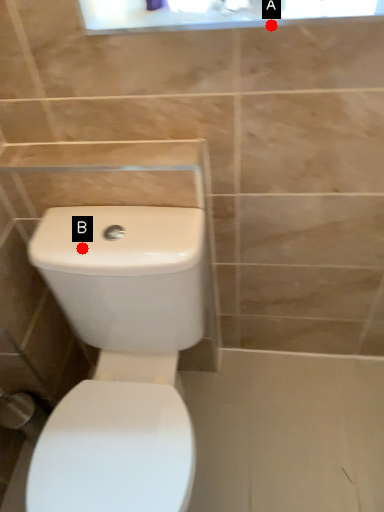
Question: Two points are circled on the image, labeled by A and B beside each circle. Which point is farther from the camera taking this photo?

Choices:
 (A) A is further
 (B) B is further

Answer: (B)